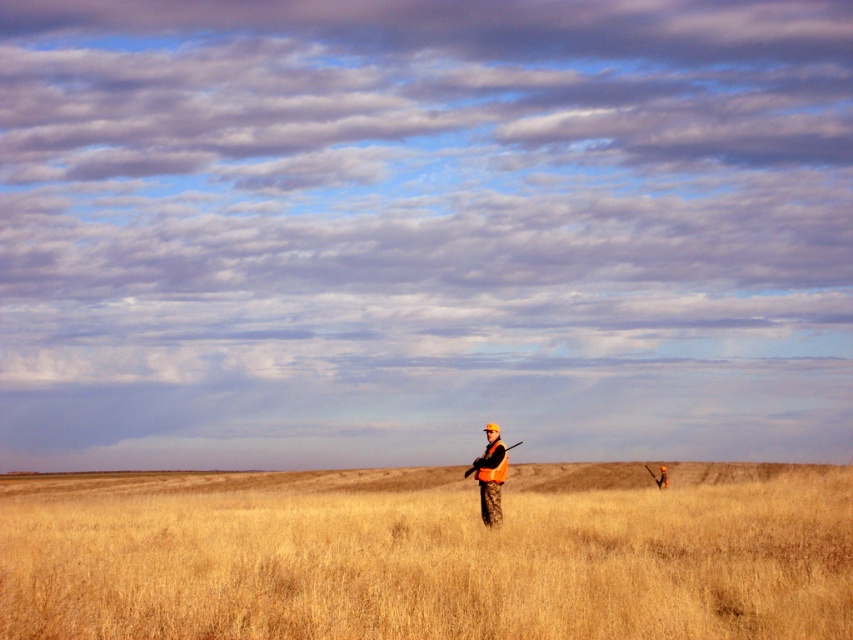
Question: Which point is closer to the camera?

Choices:
 (A) (663, 476)
 (B) (497, 492)

Answer: (B)

Question: Considering the real-world distances, which object is farthest from the dry grassland at center?

Choices:
 (A) camouflage jacket at center
 (B) orange reflective vest at center

Answer: (B)

Question: Does dry grassland at center have a larger size compared to camouflage jacket at center?

Choices:
 (A) yes
 (B) no

Answer: (A)

Question: Among these objects, which one is farthest from the camera?

Choices:
 (A) camouflage jacket at center
 (B) dry grassland at center

Answer: (A)

Question: Is the position of camouflage jacket at center more distant than that of orange reflective vest at center?

Choices:
 (A) yes
 (B) no

Answer: (B)

Question: Considering the relative positions of dry grassland at center and camouflage jacket at center in the image provided, where is dry grassland at center located with respect to camouflage jacket at center?

Choices:
 (A) below
 (B) above

Answer: (A)